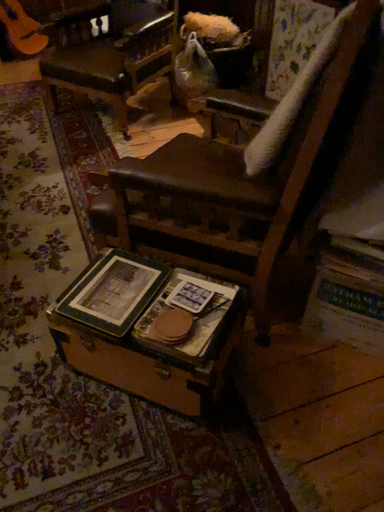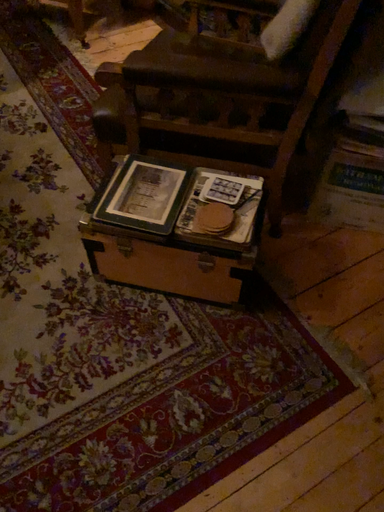
Question: How did the camera likely rotate when shooting the video?

Choices:
 (A) rotated left
 (B) rotated right

Answer: (B)